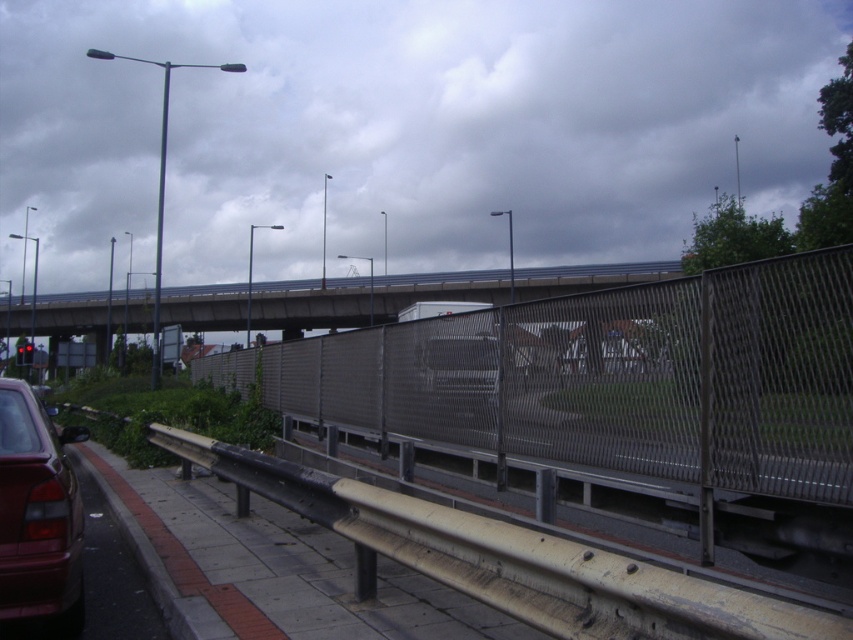
Question: Does metal mesh fence at center have a smaller size compared to shiny red car at lower left?

Choices:
 (A) no
 (B) yes

Answer: (A)

Question: Which point is farther to the camera?

Choices:
 (A) (241, 381)
 (B) (77, 612)

Answer: (A)

Question: Is metal mesh fence at center positioned before shiny red car at lower left?

Choices:
 (A) yes
 (B) no

Answer: (B)

Question: Considering the relative positions of metal mesh fence at center and shiny red car at lower left in the image provided, where is metal mesh fence at center located with respect to shiny red car at lower left?

Choices:
 (A) right
 (B) left

Answer: (B)

Question: Which point appears farthest from the camera in this image?

Choices:
 (A) (747, 445)
 (B) (245, 317)
 (C) (15, 552)

Answer: (B)

Question: Which object appears farthest from the camera in this image?

Choices:
 (A) shiny red car at lower left
 (B) concrete bridge at upper center
 (C) metal mesh fence at center

Answer: (B)